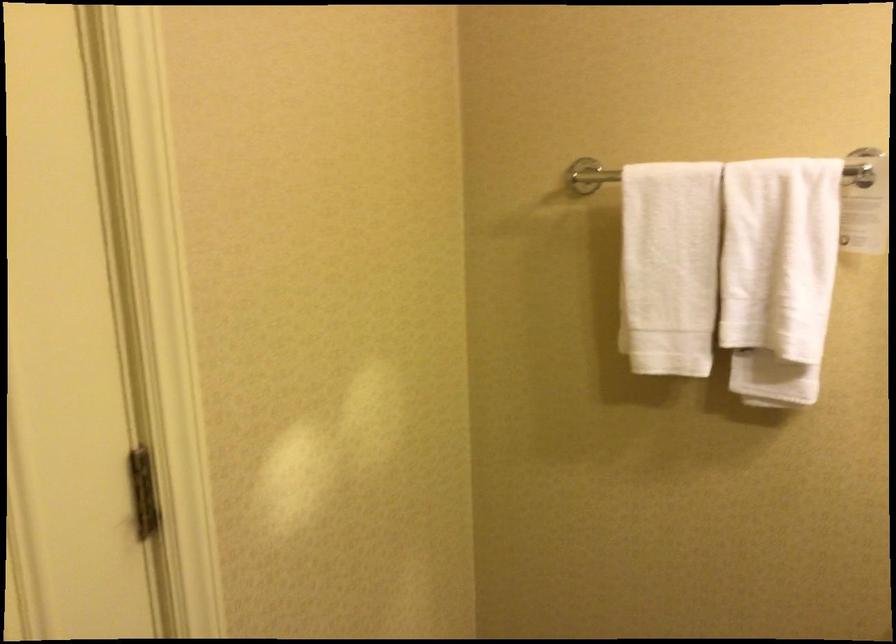
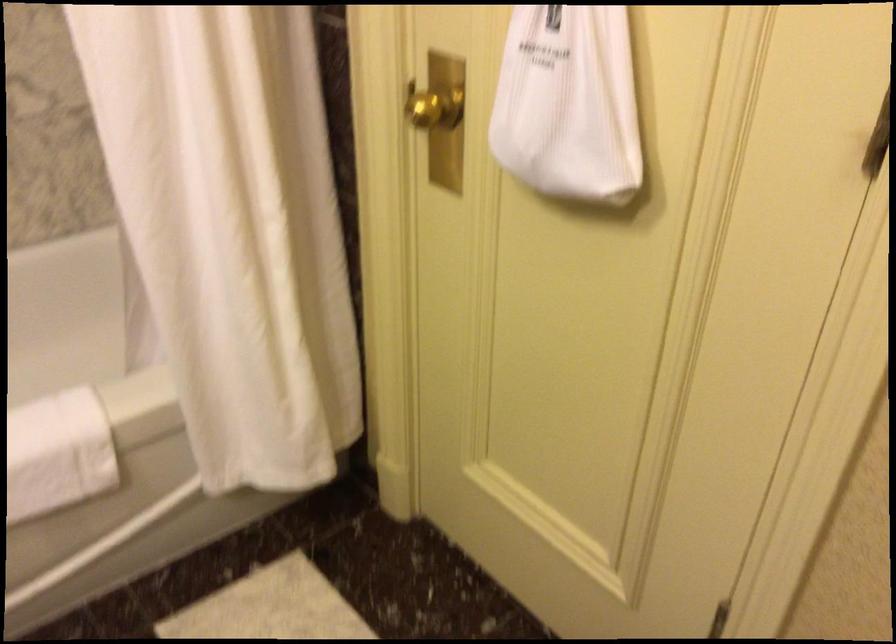
How did the camera likely rotate?

The camera rotated toward left-down.